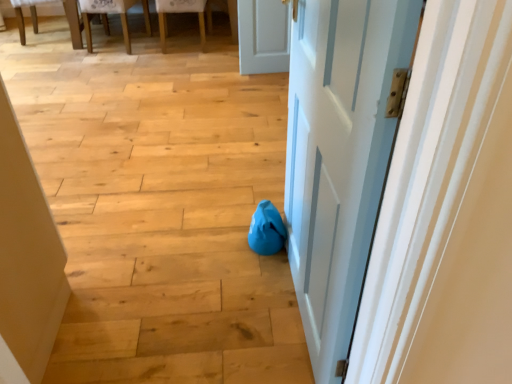
I want to click on free space between wooden chair at upper left, the 1th chair from the right, and blue fabric bean bag at center, so click(214, 113).